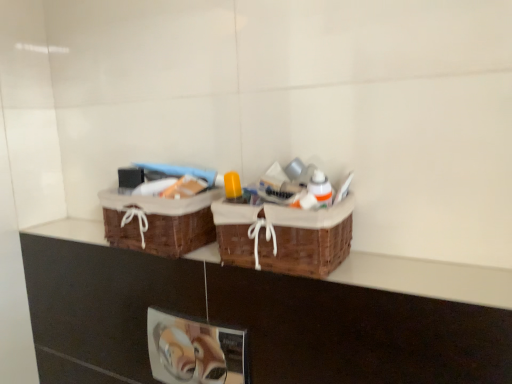
Question: Considering the positions of brown woven baskets at upper center and woven brown picnic basket at center, the first picnic basket when ordered from right to left, in the image, is brown woven baskets at upper center bigger or smaller than woven brown picnic basket at center, the first picnic basket when ordered from right to left,?

Choices:
 (A) big
 (B) small

Answer: (B)

Question: Is brown woven baskets at upper center taller or shorter than woven brown picnic basket at center, the first picnic basket when ordered from right to left?

Choices:
 (A) tall
 (B) short

Answer: (B)

Question: Estimate the real-world distances between objects in this image. Which object is farther from the woven brown picnic basket at center, the first picnic basket when ordered from right to left?

Choices:
 (A) brown woven picnic basket at center, which is the first picnic basket in left-to-right order
 (B) brown woven baskets at upper center

Answer: (A)

Question: Which object is positioned farthest from the brown woven baskets at upper center?

Choices:
 (A) brown woven picnic basket at center, positioned as the second picnic basket in right-to-left order
 (B) woven brown picnic basket at center, the first picnic basket when ordered from right to left

Answer: (B)